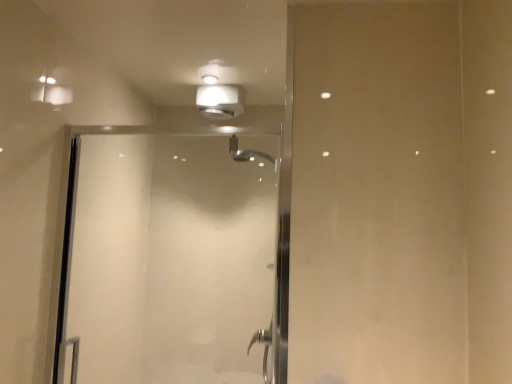
Based on the photo, measure the distance between point (214,110) and camera.

The distance of point (214,110) from camera is 7.34 feet.

This screenshot has height=384, width=512. What do you see at coordinates (219, 92) in the screenshot? I see `matte white light fixture at upper center` at bounding box center [219, 92].

Image resolution: width=512 pixels, height=384 pixels. I want to click on matte white light fixture at upper center, so click(x=219, y=92).

What are the coordinates of `transparent glass shower door at center` in the screenshot? It's located at (166, 261).

What do you see at coordinates (166, 261) in the screenshot?
I see `transparent glass shower door at center` at bounding box center [166, 261].

Identify the location of matte white light fixture at upper center. (219, 92).

Can you confirm if matte white light fixture at upper center is positioned to the right of transparent glass shower door at center?

Correct, you'll find matte white light fixture at upper center to the right of transparent glass shower door at center.

Is matte white light fixture at upper center positioned before transparent glass shower door at center?

No, the depth of matte white light fixture at upper center is greater than that of transparent glass shower door at center.

Is point (238, 109) closer to viewer compared to point (77, 200)?

No, (238, 109) is behind (77, 200).

From the image's perspective, between matte white light fixture at upper center and transparent glass shower door at center, which one is located above?

matte white light fixture at upper center is shown above in the image.

From a real-world perspective, which object rests below the other?

transparent glass shower door at center.

Between matte white light fixture at upper center and transparent glass shower door at center, which one has larger width?

Wider between the two is matte white light fixture at upper center.

Considering the sizes of objects matte white light fixture at upper center and transparent glass shower door at center in the image provided, who is taller, matte white light fixture at upper center or transparent glass shower door at center?

Standing taller between the two is transparent glass shower door at center.

Based on their sizes in the image, would you say matte white light fixture at upper center is bigger or smaller than transparent glass shower door at center?

In the image, matte white light fixture at upper center appears to be smaller than transparent glass shower door at center.

Is matte white light fixture at upper center situated inside transparent glass shower door at center or outside?

matte white light fixture at upper center is not enclosed by transparent glass shower door at center.

Are matte white light fixture at upper center and transparent glass shower door at center beside each other?

There is a gap between matte white light fixture at upper center and transparent glass shower door at center.

Based on the photo, is matte white light fixture at upper center oriented away from transparent glass shower door at center?

matte white light fixture at upper center is not turned away from transparent glass shower door at center.

What are the coordinates of `light fixture above the transparent glass shower door at center (from a real-world perspective)` in the screenshot? It's located at (219, 92).

Visually, is transparent glass shower door at center positioned to the left or to the right of matte white light fixture at upper center?

Based on their positions, transparent glass shower door at center is located to the left of matte white light fixture at upper center.

Between transparent glass shower door at center and matte white light fixture at upper center, which one is positioned in front?

Positioned in front is transparent glass shower door at center.

Does point (227, 260) come farther from viewer compared to point (224, 86)?

Yes.

From the image's perspective, is transparent glass shower door at center located beneath matte white light fixture at upper center?

Yes.

From a real-world perspective, is transparent glass shower door at center below matte white light fixture at upper center?

Correct, in the physical world, transparent glass shower door at center is lower than matte white light fixture at upper center.

Which object is thinner, transparent glass shower door at center or matte white light fixture at upper center?

Thinner between the two is transparent glass shower door at center.

Based on the photo, does transparent glass shower door at center have a lesser height compared to matte white light fixture at upper center?

Incorrect, the height of transparent glass shower door at center does not fall short of that of matte white light fixture at upper center.

Considering the sizes of objects transparent glass shower door at center and matte white light fixture at upper center in the image provided, who is smaller, transparent glass shower door at center or matte white light fixture at upper center?

matte white light fixture at upper center is smaller.

Consider the image. Is transparent glass shower door at center positioned beyond the bounds of matte white light fixture at upper center?

transparent glass shower door at center lies outside matte white light fixture at upper center's area.

Are transparent glass shower door at center and matte white light fixture at upper center located far from each other?

Actually, transparent glass shower door at center and matte white light fixture at upper center are a little close together.

Is transparent glass shower door at center turned away from matte white light fixture at upper center?

transparent glass shower door at center is not turned away from matte white light fixture at upper center.

Can you tell me how much transparent glass shower door at center and matte white light fixture at upper center differ in facing direction?

They differ by 3.03 degrees in their facing directions.

Measure the distance from transparent glass shower door at center to matte white light fixture at upper center.

28.49 inches.

Where is `light fixture behind the transparent glass shower door at center`? The width and height of the screenshot is (512, 384). light fixture behind the transparent glass shower door at center is located at coordinates (219, 92).

The width and height of the screenshot is (512, 384). What are the coordinates of `light fixture above the transparent glass shower door at center (from the image's perspective)` in the screenshot? It's located at (219, 92).

In order to click on screen door on the left of matte white light fixture at upper center in this screenshot , I will do `click(166, 261)`.